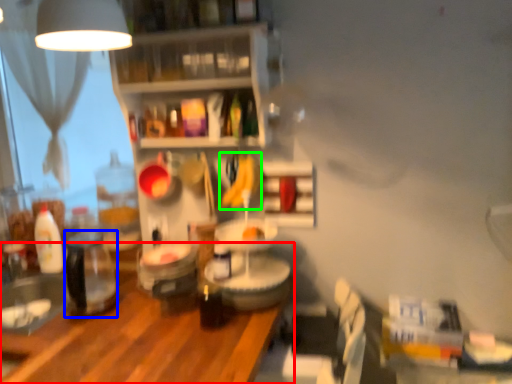
Question: Considering the real-world distances, which object is farthest from table (highlighted by a red box)? appliance (highlighted by a blue box) or banana (highlighted by a green box)?

Choices:
 (A) appliance
 (B) banana

Answer: (B)